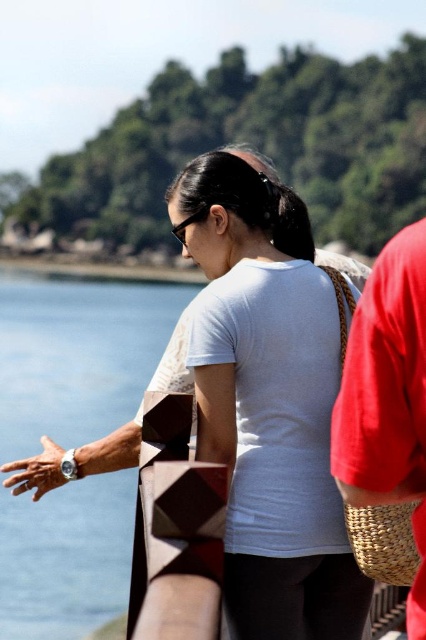
You are standing at the origin point in the image. The white matte shirt at center is represented by point (268, 403). Which direction should you move to reach the white matte shirt at center?

To reach the white matte shirt at center, you should move towards the point with coordinates (268, 403).